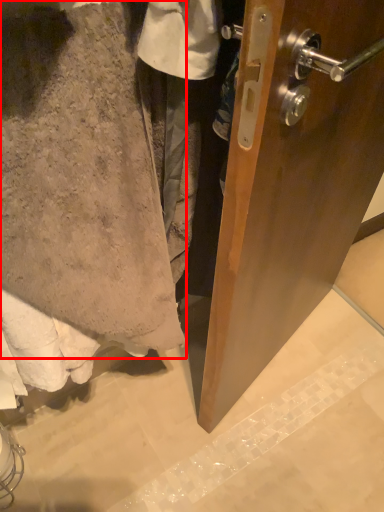
Question: In this image, where is towel (annotated by the red box) located relative to concrete?

Choices:
 (A) left
 (B) right

Answer: (A)